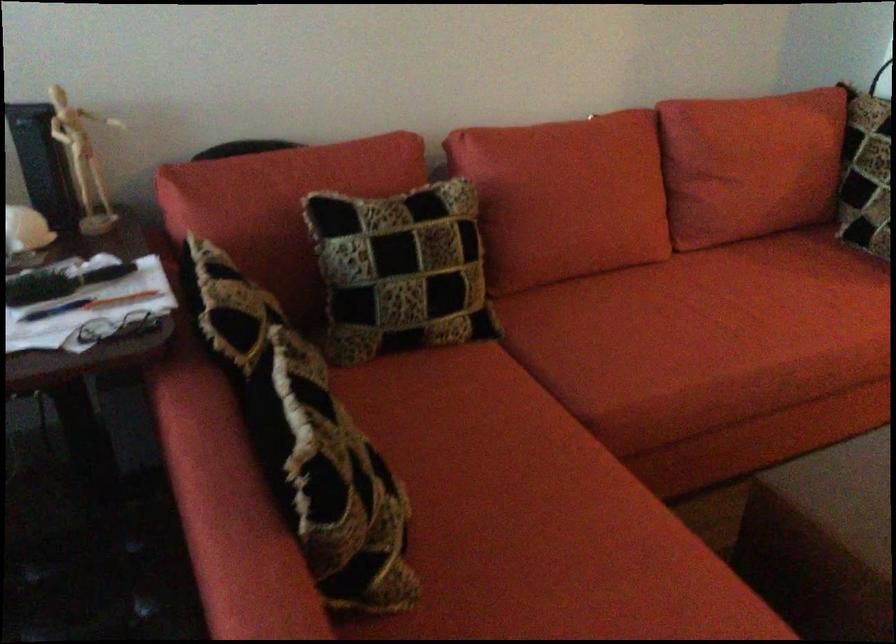
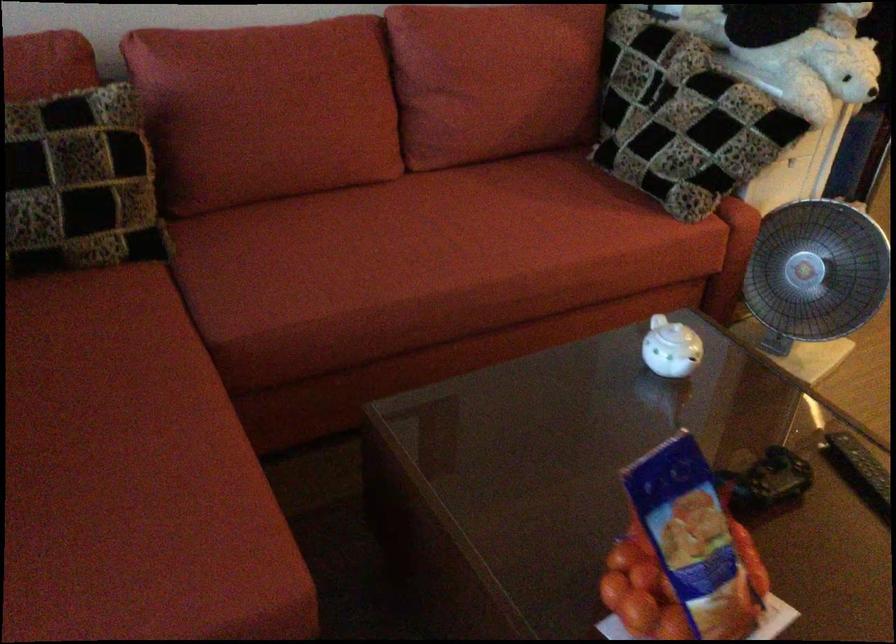
Question: The first image is from the beginning of the video and the second image is from the end. How did the camera likely rotate when shooting the video?

Choices:
 (A) Left
 (B) Right
 (C) Up
 (D) Down

Answer: (D)